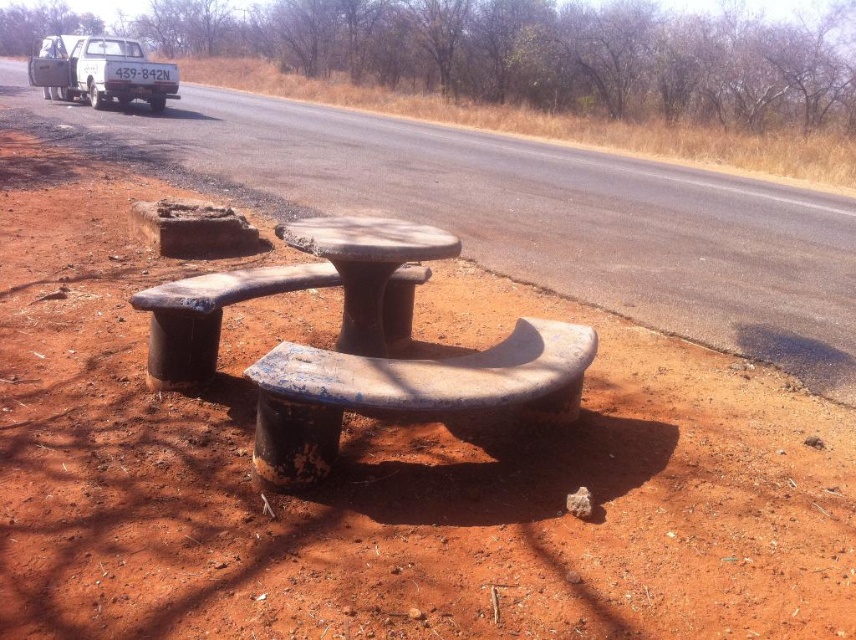
Image resolution: width=856 pixels, height=640 pixels. Describe the element at coordinates (408, 392) in the screenshot. I see `blue painted wood bench at center` at that location.

Is blue painted wood bench at center bigger than rusty wood bench at center?

Indeed, blue painted wood bench at center has a larger size compared to rusty wood bench at center.

The image size is (856, 640). What do you see at coordinates (408, 392) in the screenshot?
I see `blue painted wood bench at center` at bounding box center [408, 392].

This screenshot has width=856, height=640. I want to click on blue painted wood bench at center, so click(408, 392).

Does rusty wood bench at center appear on the left side of rusty concrete table at center?

Yes, rusty wood bench at center is to the left of rusty concrete table at center.

Which is behind, point (305, 275) or point (351, 285)?

The point (305, 275) is more distant.

What do you see at coordinates (210, 316) in the screenshot? I see `rusty wood bench at center` at bounding box center [210, 316].

I want to click on rusty wood bench at center, so click(210, 316).

Can you confirm if blue painted wood bench at center is positioned above rusty concrete table at center?

Actually, blue painted wood bench at center is below rusty concrete table at center.

This screenshot has width=856, height=640. What do you see at coordinates (408, 392) in the screenshot? I see `blue painted wood bench at center` at bounding box center [408, 392].

Locate an element on the screen. The height and width of the screenshot is (640, 856). blue painted wood bench at center is located at coordinates (408, 392).